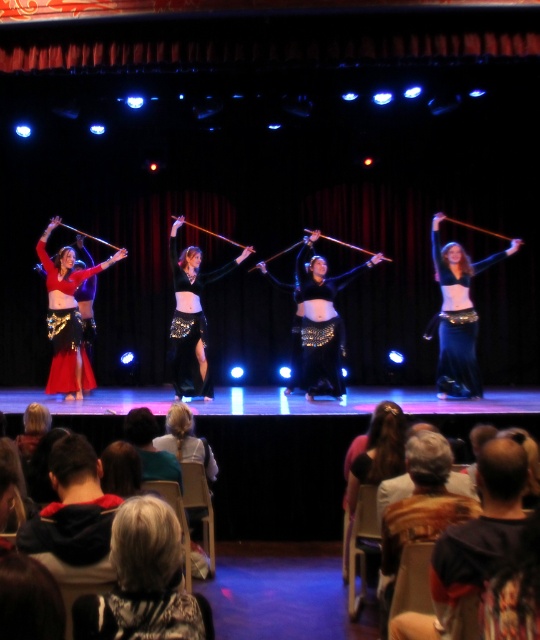
Question: Which is nearer to the shiny red fabric at left?

Choices:
 (A) black sequined belly dancer at center
 (B) shiny black fabric at center
 (C) dark brown leather jacket at lower right

Answer: (A)

Question: Can you confirm if dark brown leather jacket at lower right is thinner than dark gray hoodie at lower left?

Choices:
 (A) no
 (B) yes

Answer: (A)

Question: Estimate the real-world distances between objects in this image. Which object is farther from the dark brown hair at lower center?

Choices:
 (A) gray hair at lower center
 (B) black sequined belly dancer at center
 (C) dark brown leather jacket at lower right

Answer: (B)

Question: Is dark brown leather jacket at lower right to the left of dark brown hair at lower center from the viewer's perspective?

Choices:
 (A) yes
 (B) no

Answer: (B)

Question: Among these objects, which one is farthest from the camera?

Choices:
 (A) dark brown leather jacket at lower right
 (B) gray hair at lower center

Answer: (A)

Question: Observing the image, what is the correct spatial positioning of dark gray hoodie at lower left in reference to shiny black fabric at center?

Choices:
 (A) left
 (B) right

Answer: (A)